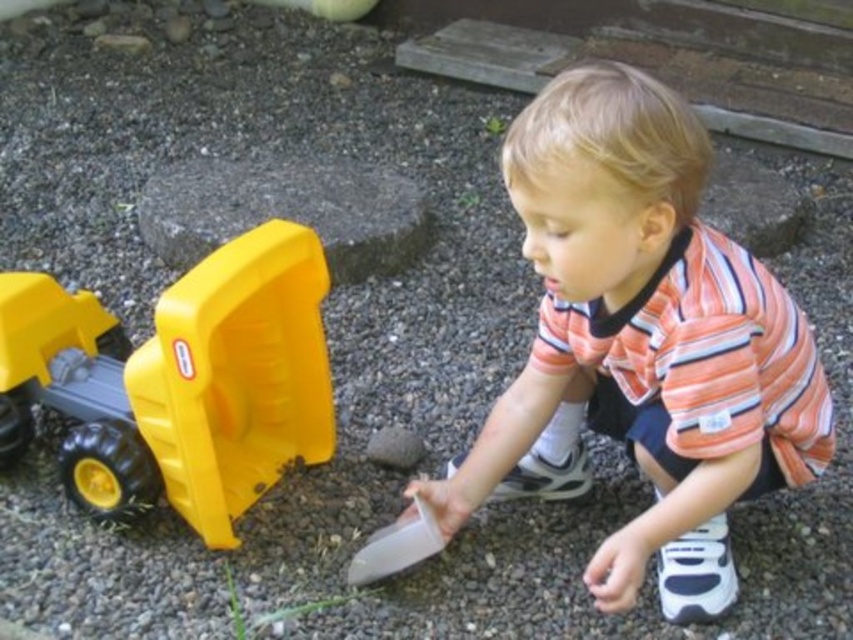
The child is wearing an orange striped shirt at center and playing with a yellow plastic toy truck at left. If the child moves forward, which object will be closer to the front of the scene?

The orange striped shirt at center is in front of the yellow plastic toy truck at left, so moving forward, the orange striped shirt at center will remain closer to the front of the scene.

You are standing at the camera position and want to throw a ball to reach the point marked as point (740, 465). If your throwing range is 1.2 meters, will you be able to reach it?

The distance between point (740, 465) and the camera is 1.19 meters. Since your throwing range is 1.2 meters, you can reach it.

You are a parent trying to ensure your child stays visible in a park. You notice the orange striped shirt at center and the yellow plastic toy truck at left. Which item is bigger and therefore more likely to catch someone else passing by?

The orange striped shirt at center is larger in size than the yellow plastic toy truck at left, so it is more likely to catch someone else passing by.